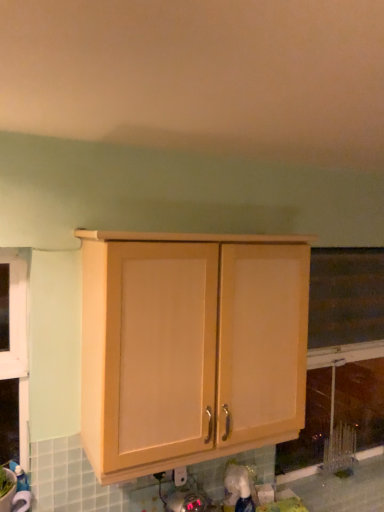
The image size is (384, 512). I want to click on light wood cabinet at center, so click(x=190, y=347).

Describe the element at coordinates (190, 347) in the screenshot. The width and height of the screenshot is (384, 512). I see `light wood cabinet at center` at that location.

Where is `light wood cabinet at center`? Image resolution: width=384 pixels, height=512 pixels. light wood cabinet at center is located at coordinates (190, 347).